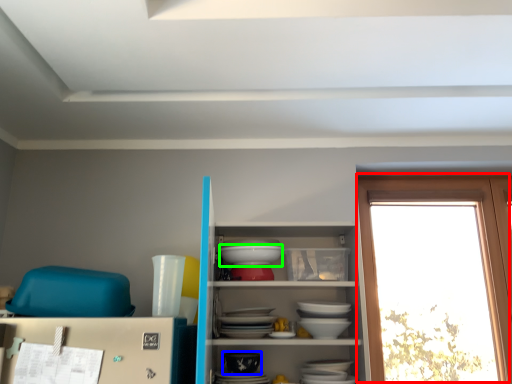
Question: Based on their relative distances, which object is nearer to window (highlighted by a red box)? Choose from tableware (highlighted by a blue box) and table (highlighted by a green box).

Choices:
 (A) tableware
 (B) table

Answer: (B)